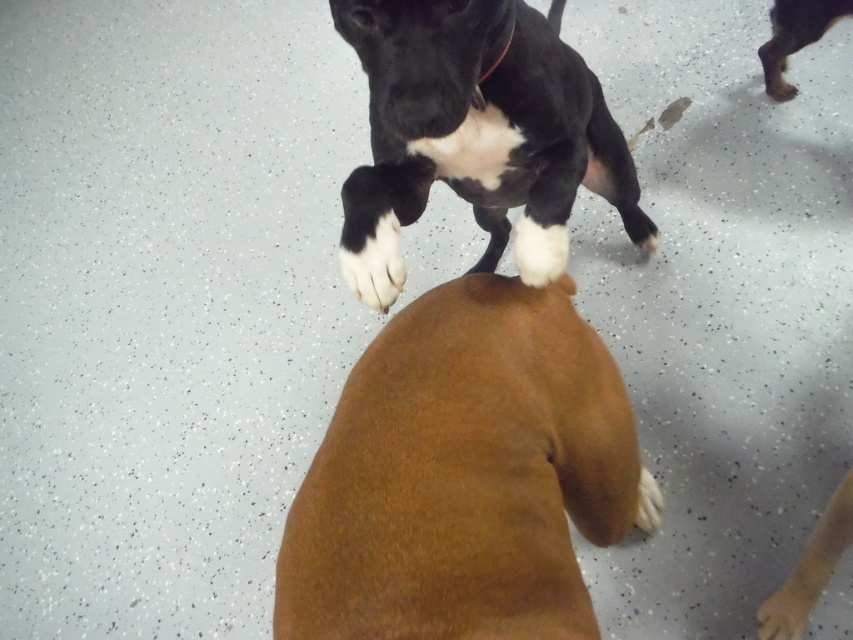
Question: Estimate the real-world distances between objects in this image. Which object is closer to the white fur at lower center?

Choices:
 (A) brown furry dog at center
 (B) black nylon neckband at upper center
 (C) brown fur dog at upper right
 (D) black smooth dog at upper center

Answer: (A)

Question: Is black smooth dog at upper center below black nylon neckband at upper center?

Choices:
 (A) no
 (B) yes

Answer: (B)

Question: Is brown fur dog at upper right positioned at the back of white fur at lower center?

Choices:
 (A) yes
 (B) no

Answer: (A)

Question: Does black smooth dog at upper center have a greater width compared to brown fur dog at upper right?

Choices:
 (A) yes
 (B) no

Answer: (A)

Question: Among these points, which one is farthest from the camera?

Choices:
 (A) (782, 621)
 (B) (772, 76)
 (C) (381, 300)
 (D) (509, 298)

Answer: (B)

Question: Which object is farther from the camera taking this photo?

Choices:
 (A) brown furry dog at center
 (B) brown furry paw at lower right
 (C) black smooth dog at upper center

Answer: (B)